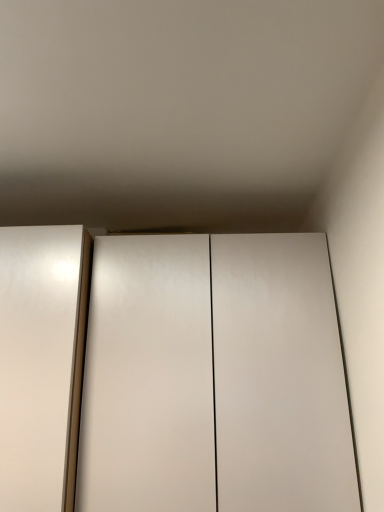
Question: Considering the relative sizes of white glossy cupboard at center and white glossy elevator at left in the image provided, is white glossy cupboard at center shorter than white glossy elevator at left?

Choices:
 (A) no
 (B) yes

Answer: (A)

Question: Is white glossy elevator at left inside white glossy cupboard at center?

Choices:
 (A) yes
 (B) no

Answer: (B)

Question: Is white glossy cupboard at center with white glossy elevator at left?

Choices:
 (A) no
 (B) yes

Answer: (A)

Question: Can you confirm if white glossy cupboard at center is positioned to the left of white glossy elevator at left?

Choices:
 (A) no
 (B) yes

Answer: (A)

Question: Is white glossy cupboard at center positioned beyond the bounds of white glossy elevator at left?

Choices:
 (A) yes
 (B) no

Answer: (A)

Question: From the image's perspective, would you say white glossy cupboard at center is shown under white glossy elevator at left?

Choices:
 (A) yes
 (B) no

Answer: (A)

Question: From the image's perspective, would you say white glossy elevator at left is positioned over white glossy cupboard at center?

Choices:
 (A) yes
 (B) no

Answer: (A)

Question: Is white glossy elevator at left bigger than white glossy cupboard at center?

Choices:
 (A) yes
 (B) no

Answer: (B)

Question: From a real-world perspective, is white glossy elevator at left located higher than white glossy cupboard at center?

Choices:
 (A) no
 (B) yes

Answer: (B)

Question: Does white glossy elevator at left lie behind white glossy cupboard at center?

Choices:
 (A) no
 (B) yes

Answer: (A)

Question: Does white glossy elevator at left appear on the right side of white glossy cupboard at center?

Choices:
 (A) yes
 (B) no

Answer: (B)

Question: From the image's perspective, would you say white glossy elevator at left is shown under white glossy cupboard at center?

Choices:
 (A) no
 (B) yes

Answer: (A)

Question: From a real-world perspective, is white glossy cupboard at center positioned above or below white glossy elevator at left?

Choices:
 (A) below
 (B) above

Answer: (A)